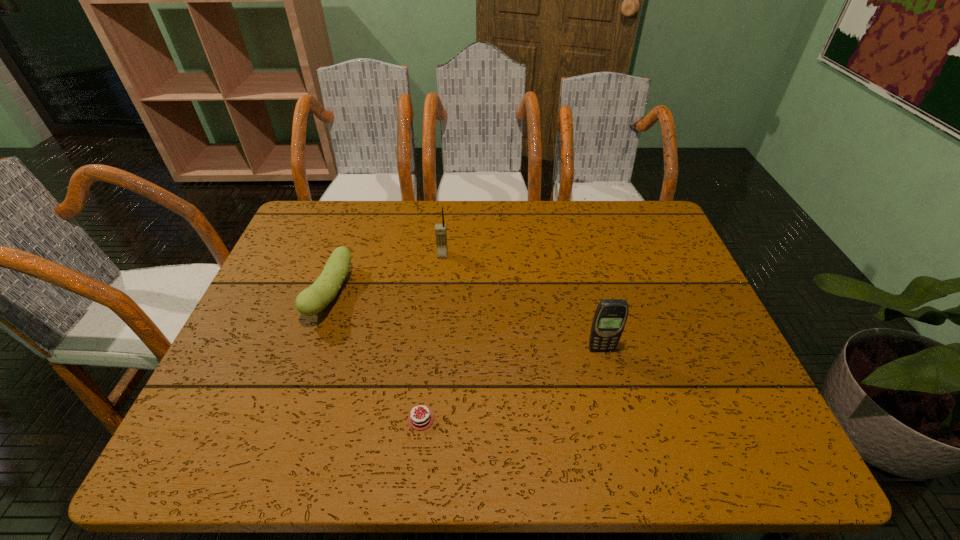
The width and height of the screenshot is (960, 540). I want to click on free space located 0.140m on the right of the third nearest object, so click(x=402, y=294).

The width and height of the screenshot is (960, 540). In order to click on vacant point located 0.310m on the left of the chocolate cake in this screenshot , I will do `click(232, 418)`.

The width and height of the screenshot is (960, 540). I want to click on object that is at the near edge, so click(422, 418).

The width and height of the screenshot is (960, 540). Find the location of `object that is at the left edge`. object that is at the left edge is located at coordinates (312, 300).

Where is `free space at the far edge of the desktop`? The width and height of the screenshot is (960, 540). free space at the far edge of the desktop is located at coordinates (595, 241).

Where is `vacant region at the near edge of the desktop`? vacant region at the near edge of the desktop is located at coordinates (311, 446).

At what (x,y) coordinates should I click in order to perform the action: click on vacant region at the right edge. Please return your answer as a coordinate pair (x, y). The height and width of the screenshot is (540, 960). Looking at the image, I should click on (707, 318).

Where is `free space at the far left corner`? The height and width of the screenshot is (540, 960). free space at the far left corner is located at coordinates (311, 202).

Locate an element on the screen. This screenshot has width=960, height=540. blank space at the far right corner is located at coordinates (609, 220).

This screenshot has height=540, width=960. Identify the location of unoccupied position between the left cellular telephone and the shortest object. click(x=432, y=336).